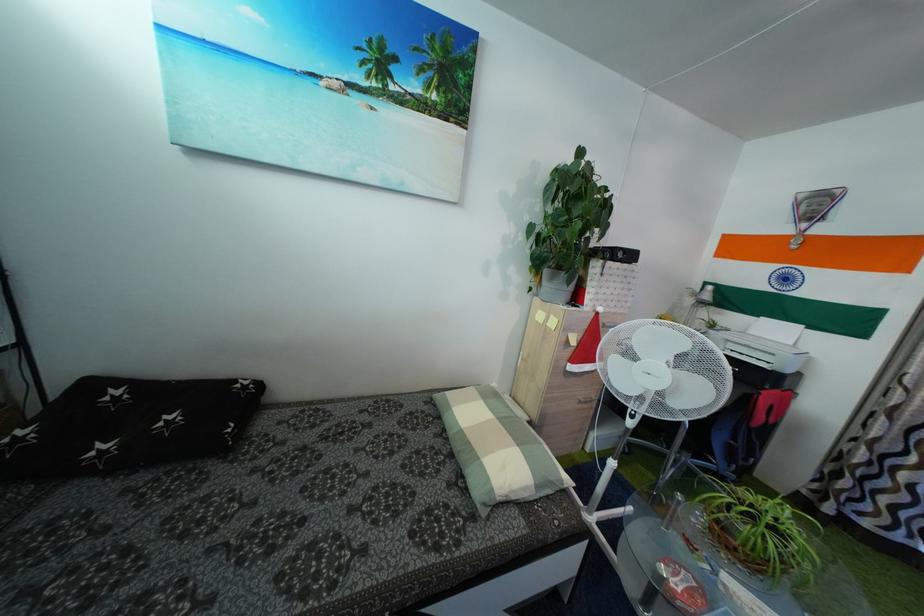
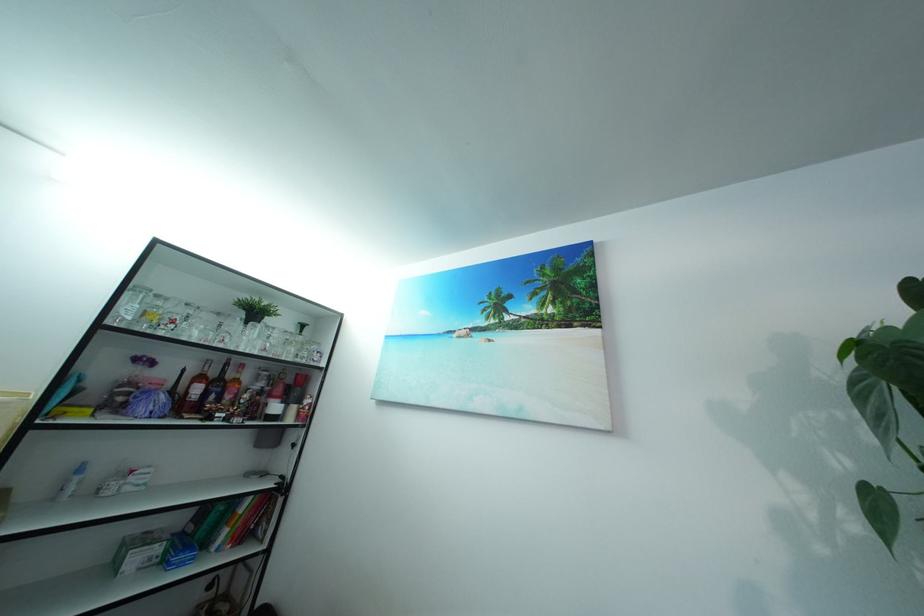
First-person continuous shooting, in which direction is the camera rotating?

The rotation direction of the camera is left-up.